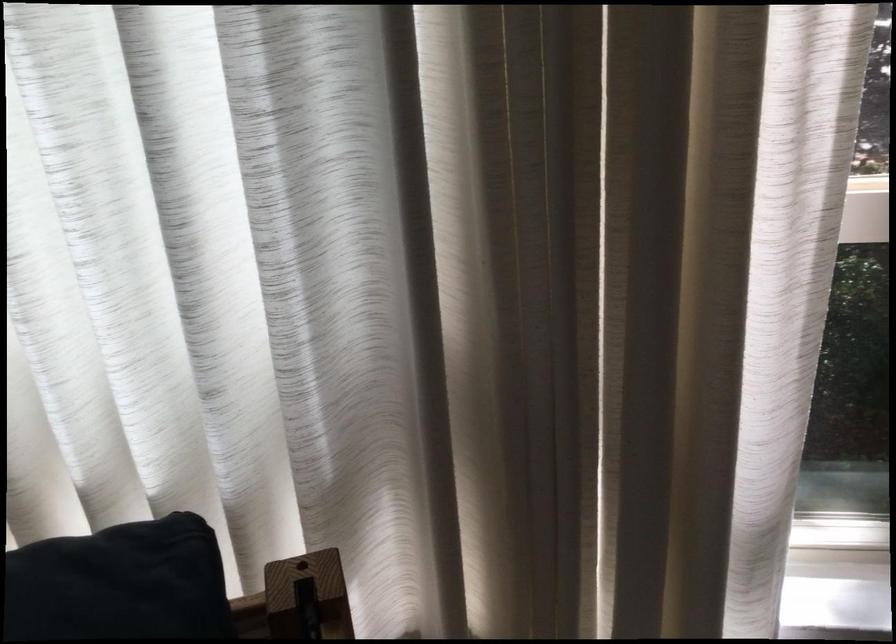
This screenshot has height=644, width=896. Identify the location of wooden chair armrest. (307, 594).